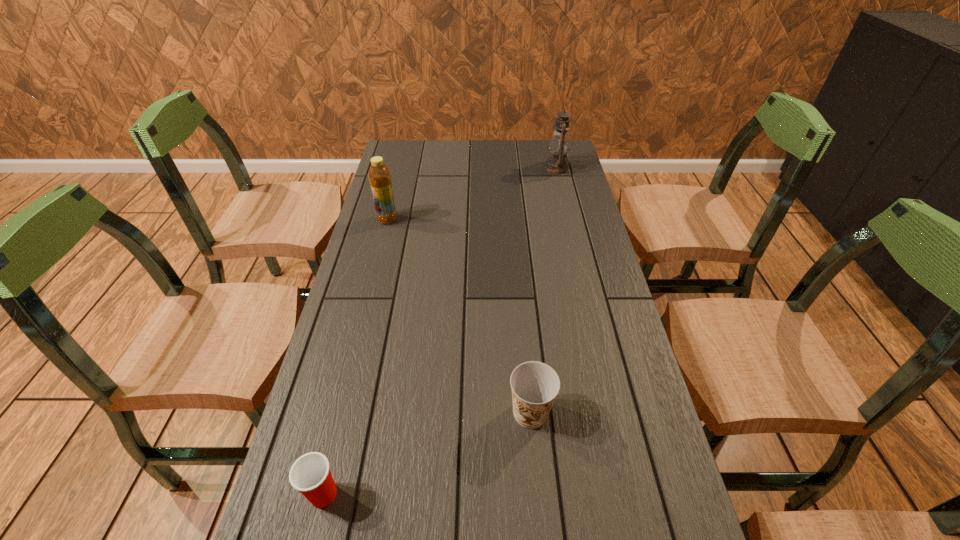
Identify the location of free space between the farthest object and the bottle. (472, 194).

In order to click on empty space that is in between the nearest object and the second farthest object in this screenshot , I will do `click(355, 357)`.

This screenshot has height=540, width=960. I want to click on object that stands as the third closest to the rightmost object, so click(x=310, y=474).

Identify which object is the third nearest to the farther Dixie cup. Please provide its 2D coordinates. Your answer should be formatted as a tuple, i.e. [(x, y)], where the tuple contains the x and y coordinates of a point satisfying the conditions above.

[(559, 145)]

Identify the location of vacant region that satisfies the following two spatial constraints: 1. on the back side of the left Dixie cup; 2. on the right side of the right Dixie cup. (344, 413).